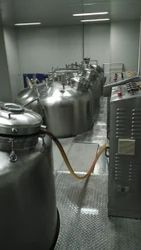
The width and height of the screenshot is (141, 250). I want to click on fluorescent ceiling lights, so click(x=83, y=14), click(x=87, y=19), click(x=33, y=24).